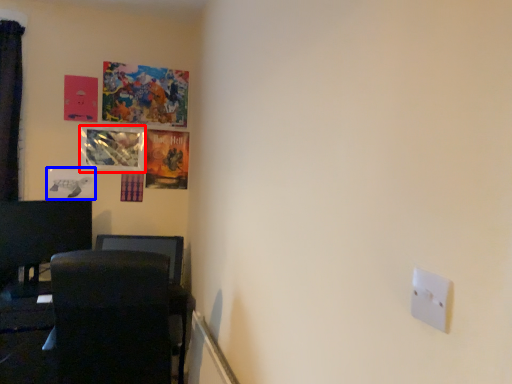
Question: Which object is closer to the camera taking this photo, picture frame (highlighted by a red box) or picture frame (highlighted by a blue box)?

Choices:
 (A) picture frame
 (B) picture frame

Answer: (B)